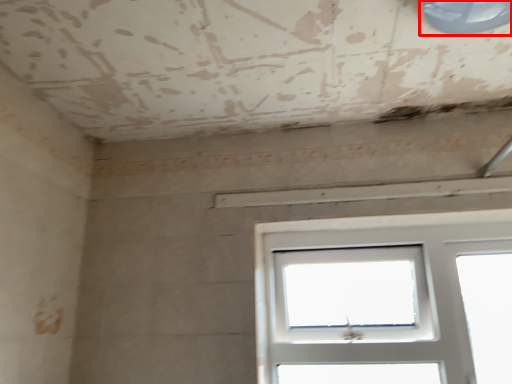
Question: In this image, where is window (annotated by the red box) located relative to window?

Choices:
 (A) right
 (B) left

Answer: (B)